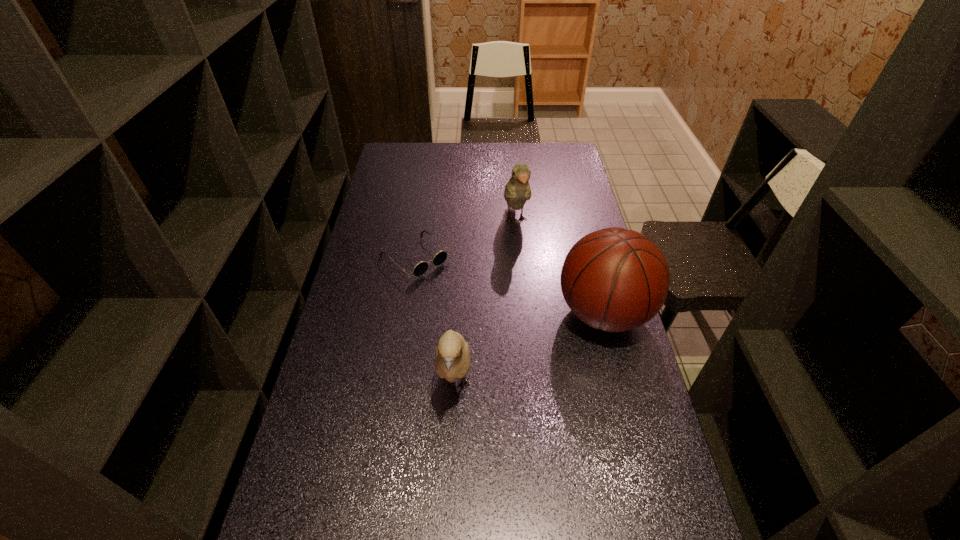
At what (x,y) coordinates should I click in order to perform the action: click on free space that is in between the third object from left to right and the basketball. Please return your answer as a coordinate pair (x, y). Image resolution: width=960 pixels, height=540 pixels. Looking at the image, I should click on (560, 267).

This screenshot has height=540, width=960. Identify the location of free space that is in between the second object from right to left and the rightmost object. (560, 267).

Locate an element on the screen. The width and height of the screenshot is (960, 540). free space that is in between the shortest object and the right bird is located at coordinates (466, 239).

At what (x,y) coordinates should I click in order to perform the action: click on empty space that is in between the right bird and the nearer bird. Please return your answer as a coordinate pair (x, y). Looking at the image, I should click on (486, 302).

The image size is (960, 540). In order to click on vacant space in between the basketball and the third object from left to right in this screenshot , I will do `click(560, 267)`.

The image size is (960, 540). Identify the location of free spot between the nearer bird and the rightmost object. (529, 348).

Where is `free space between the basketball and the farther bird`? free space between the basketball and the farther bird is located at coordinates (560, 267).

The image size is (960, 540). I want to click on free space between the right bird and the rightmost object, so pyautogui.click(x=560, y=267).

Where is `object that is the third closest to the basketball`? object that is the third closest to the basketball is located at coordinates (420, 268).

Choose which object is the third nearest neighbor to the shortest object. Please provide its 2D coordinates. Your answer should be formatted as a tuple, i.e. [(x, y)], where the tuple contains the x and y coordinates of a point satisfying the conditions above.

[(614, 279)]